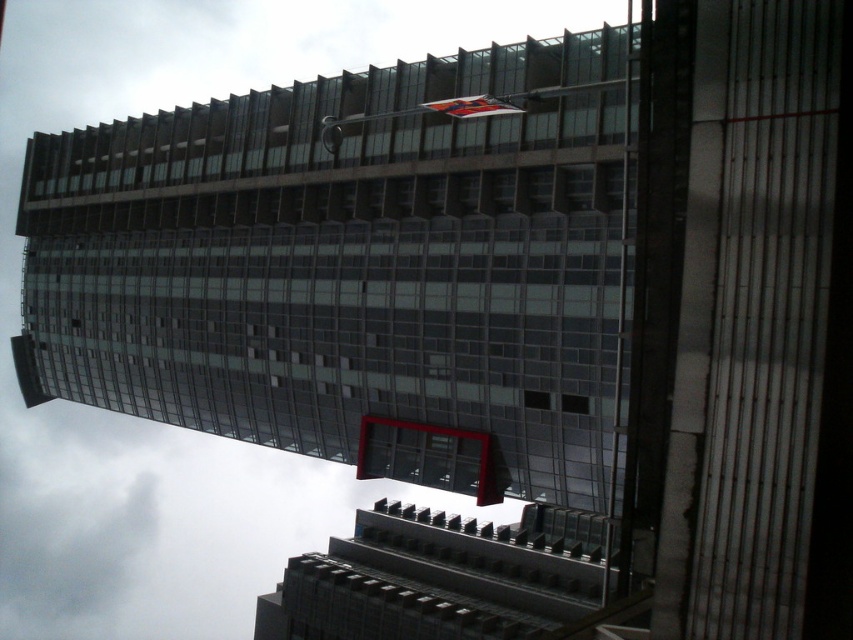
Question: Can you confirm if glassy steel tower at center is positioned to the left of red fabric flag at upper center?

Choices:
 (A) yes
 (B) no

Answer: (A)

Question: Which point is farther from the camera taking this photo?

Choices:
 (A) (279, 102)
 (B) (512, 109)

Answer: (A)

Question: Is glassy steel tower at center to the left of red fabric flag at upper center from the viewer's perspective?

Choices:
 (A) no
 (B) yes

Answer: (B)

Question: Can you confirm if glassy steel tower at center is wider than red fabric flag at upper center?

Choices:
 (A) yes
 (B) no

Answer: (A)